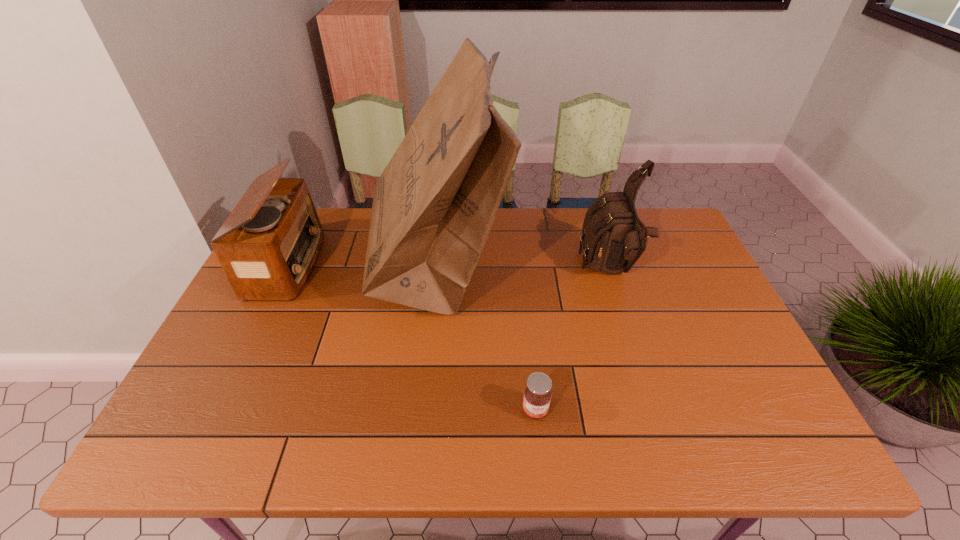
You are a GUI agent. You are given a task and a screenshot of the screen. Output one action in this format:
    pyautogui.click(x=<x>, y=<y>)
    Task: Click on the free space in the image that satisfies the following two spatial constraints: 1. on the front-facing side of the rightmost object; 2. on the label side of the nearest object
    The image size is (960, 540).
    Given the screenshot: What is the action you would take?
    pyautogui.click(x=655, y=410)

Identify the location of free spot that satisfies the following two spatial constraints: 1. on the front-facing side of the rightmost object; 2. on the label side of the shortest object. The image size is (960, 540). (655, 410).

Identify the location of free space that satisfies the following two spatial constraints: 1. on the front panel of the radio receiver; 2. on the right side of the tallest object. The height and width of the screenshot is (540, 960). (287, 267).

Identify the location of vacant region that satisfies the following two spatial constraints: 1. on the front-facing side of the rightmost object; 2. on the label side of the nearest object. The width and height of the screenshot is (960, 540). (655, 410).

Locate an element on the screen. This screenshot has width=960, height=540. vacant point that satisfies the following two spatial constraints: 1. on the front panel of the grocery bag; 2. on the left side of the radio receiver is located at coordinates (287, 267).

What are the coordinates of `blank space that satisfies the following two spatial constraints: 1. on the back side of the third object from right to left; 2. on the front panel of the leftmost object` in the screenshot? It's located at (438, 264).